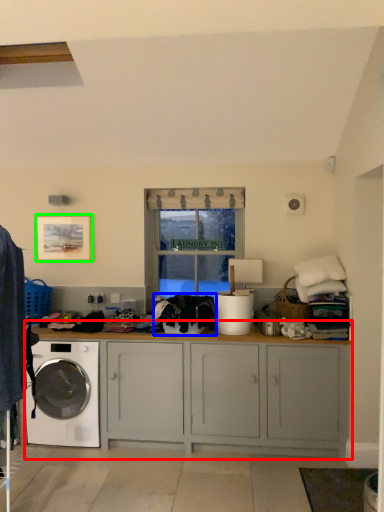
Question: Estimate the real-world distances between objects in this image. Which object is closer to cabinetry (highlighted by a red box), clothing (highlighted by a blue box) or picture frame (highlighted by a green box)?

Choices:
 (A) clothing
 (B) picture frame

Answer: (A)